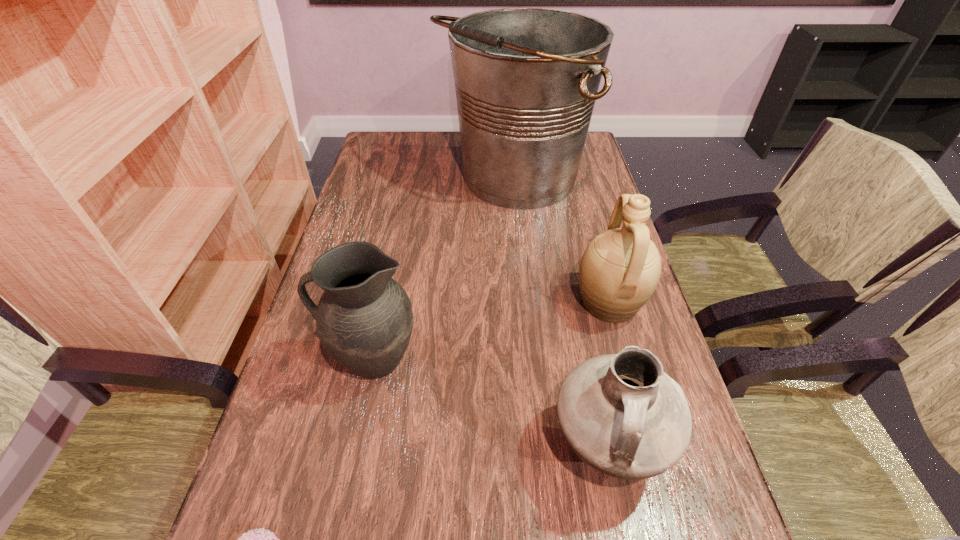
Locate an element on the screen. The image size is (960, 540). vacant space that is in between the tallest object and the leftmost pitcher is located at coordinates (443, 270).

At what (x,y) coordinates should I click in order to perform the action: click on object that can be found as the second closest to the doughnut. Please return your answer as a coordinate pair (x, y). The image size is (960, 540). Looking at the image, I should click on 621,414.

Identify the location of object that is the third nearest to the nearest object. (620, 269).

Locate an element on the screen. The width and height of the screenshot is (960, 540). pitcher that is the closest to the bucket is located at coordinates 620,269.

Locate which pitcher is the second closest to the shortest object. Please provide its 2D coordinates. Your answer should be formatted as a tuple, i.e. [(x, y)], where the tuple contains the x and y coordinates of a point satisfying the conditions above.

[(621, 414)]